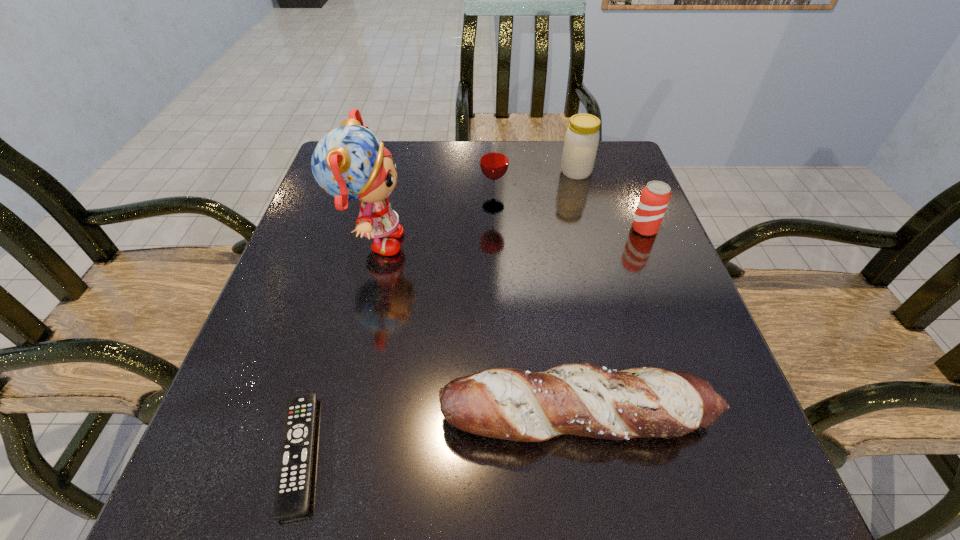
Locate an element on the screen. Image resolution: width=960 pixels, height=540 pixels. free space located 0.270m on the left of the second shortest object is located at coordinates [273, 416].

Where is `vacant space located 0.080m on the back of the remote control`? The width and height of the screenshot is (960, 540). vacant space located 0.080m on the back of the remote control is located at coordinates (326, 357).

Image resolution: width=960 pixels, height=540 pixels. In order to click on object present at the far edge in this screenshot , I will do `click(581, 142)`.

The image size is (960, 540). What are the coordinates of `object located in the near edge section of the desktop` in the screenshot? It's located at (293, 485).

Find the location of `doll present at the left edge`. doll present at the left edge is located at coordinates (350, 163).

You are a GUI agent. You are given a task and a screenshot of the screen. Output one action in this format:
    pyautogui.click(x=<x>, y=<y>)
    Task: Click on the remote control present at the left edge
    
    Given the screenshot: What is the action you would take?
    (x=293, y=485)

The width and height of the screenshot is (960, 540). What are the coordinates of `jar at the right edge` in the screenshot? It's located at (581, 142).

Identify the location of beer can that is at the right edge. Image resolution: width=960 pixels, height=540 pixels. (655, 196).

The width and height of the screenshot is (960, 540). Identify the location of baguet that is at the right edge. (583, 399).

Locate an element on the screen. The image size is (960, 540). object situated at the near left corner is located at coordinates (293, 485).